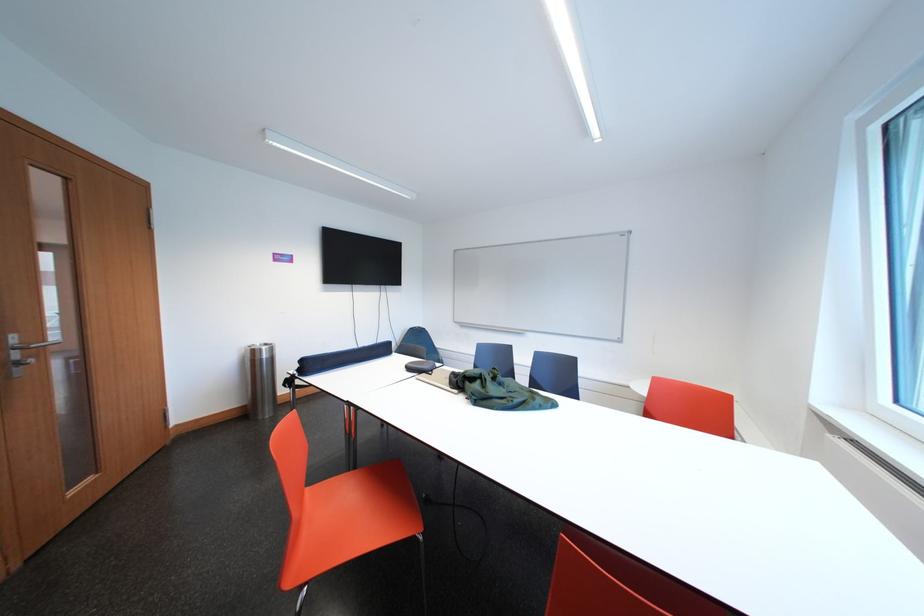
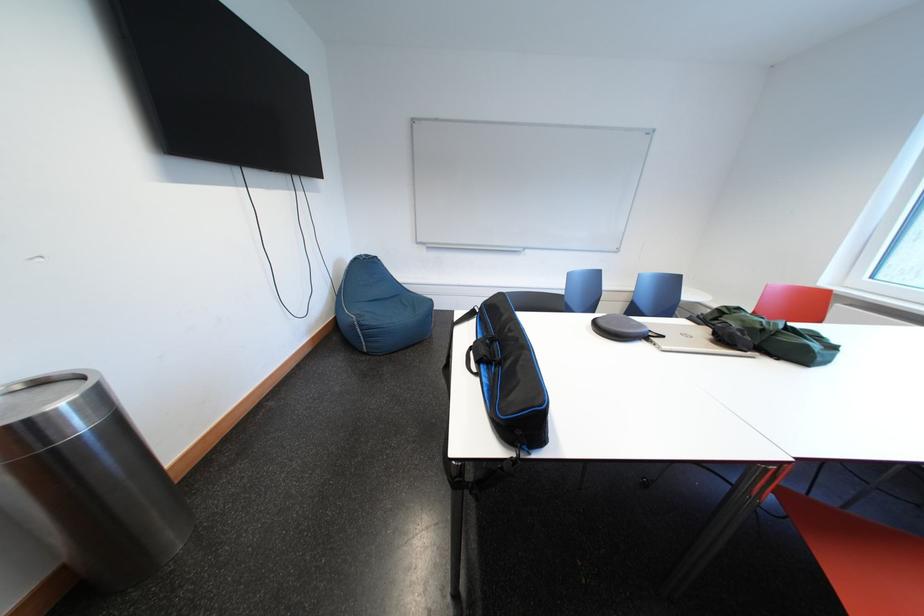
Where in the second image is the point corresponding to point (430, 376) from the first image?

(657, 341)